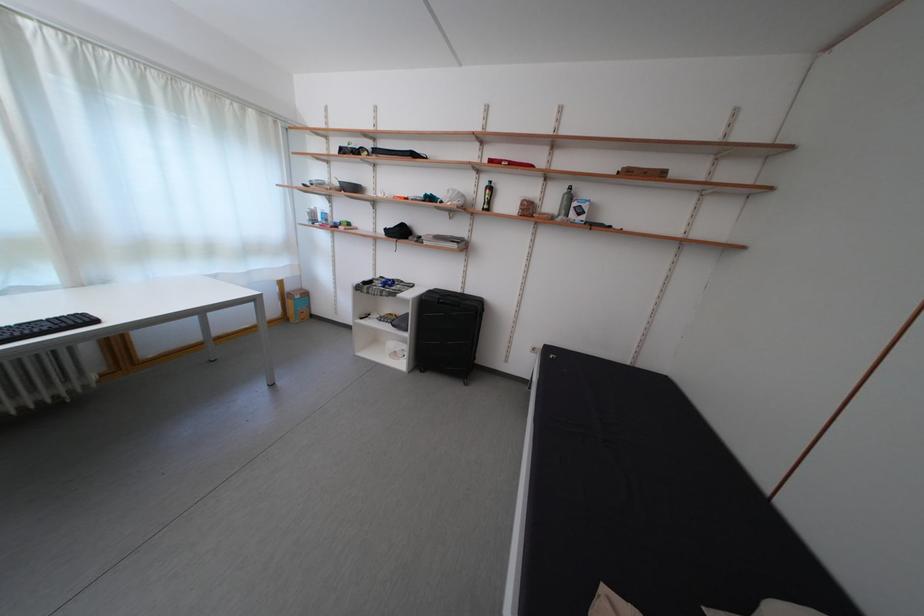
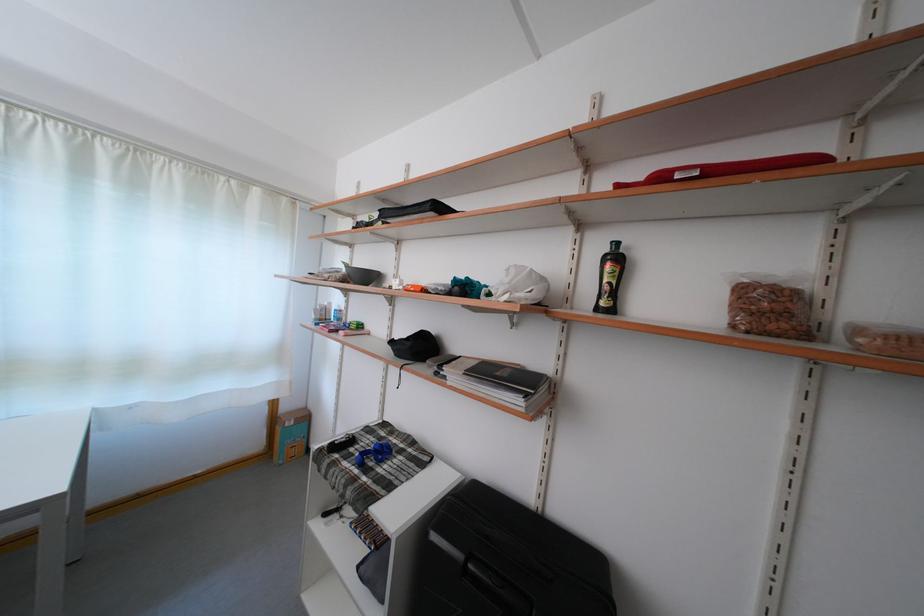
Locate, in the second image, the point that corresponds to point (298, 294) in the first image.

(293, 415)